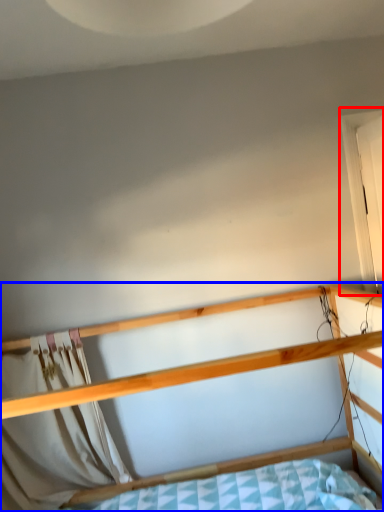
Question: Which of the following is the closest to the observer, window (highlighted by a red box) or bed (highlighted by a blue box)?

Choices:
 (A) window
 (B) bed

Answer: (B)